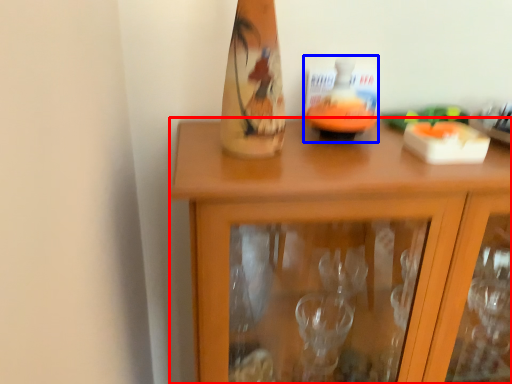
Question: Which object appears farthest to the camera in this image, cabinetry (highlighted by a red box) or candle holder (highlighted by a blue box)?

Choices:
 (A) cabinetry
 (B) candle holder

Answer: (B)